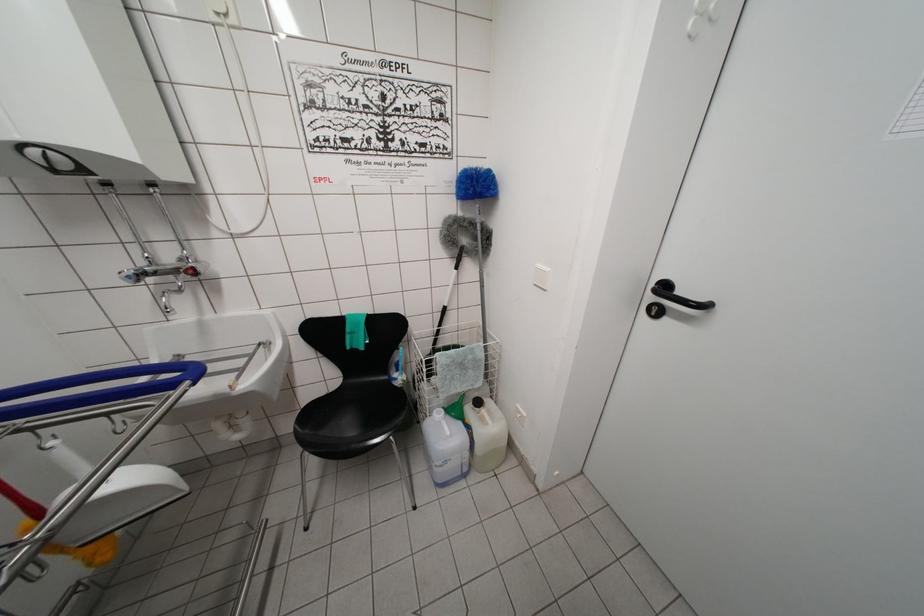
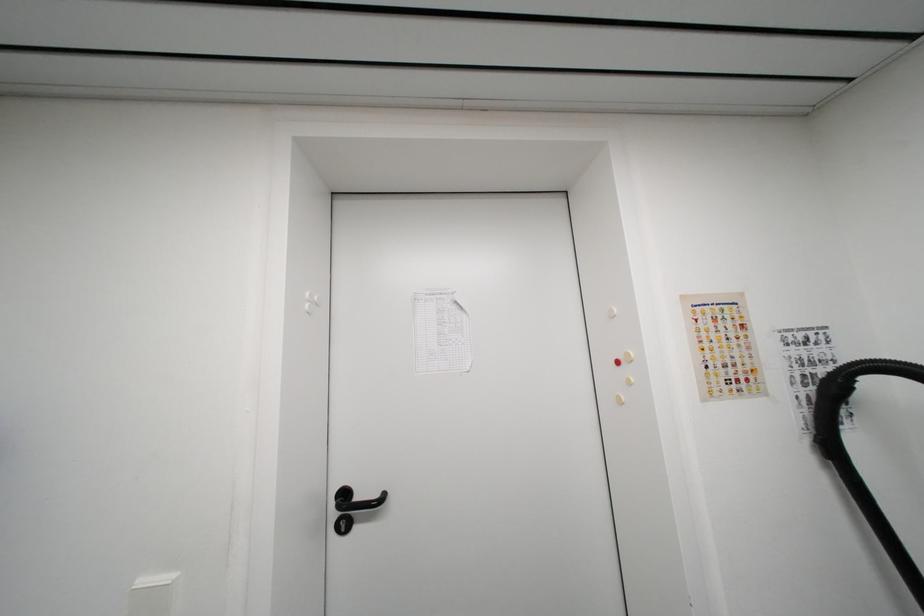
Question: The images are taken continuously from a first-person perspective. In which direction is your viewpoint rotating?

Choices:
 (A) Left
 (B) Right
 (C) Up
 (D) Down

Answer: (B)